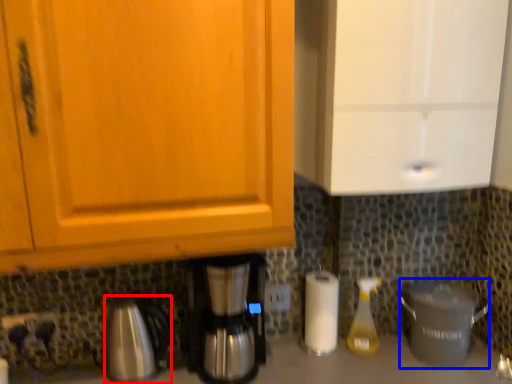
Question: Which object appears farthest to the camera in this image, coffeepot (highlighted by a red box) or crock pot (highlighted by a blue box)?

Choices:
 (A) coffeepot
 (B) crock pot

Answer: (B)